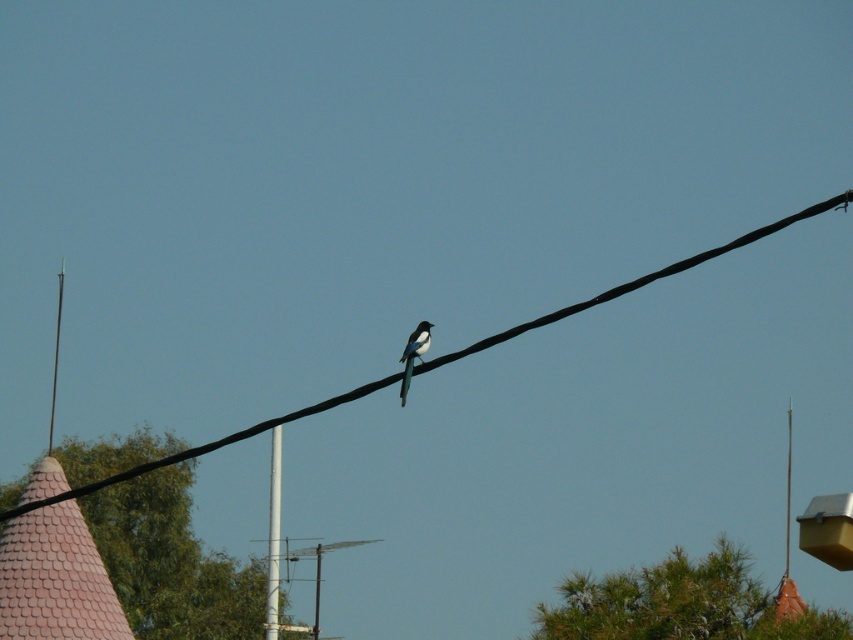
You are standing in the middle of the scene and want to walk towards the smooth white pole at left. Which direction should you head to avoid the black wire at center?

The black wire at center is to the right of the smooth white pole at left. To avoid the black wire at center, you should head to the left side of the smooth white pole at left.

You are an ornithologist observing the scene from the ground. You notice the white glossy bird at center and the smooth white pole at left. Which object is shorter in height?

The white glossy bird at center is not as tall as the smooth white pole at left, so the bird is shorter in height.